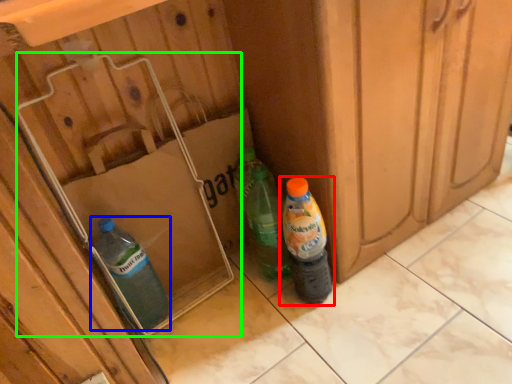
Question: Which object is the closest to the bottle (highlighted by a red box)? Choose among these: bottle (highlighted by a blue box) or cardboard box (highlighted by a green box).

Choices:
 (A) bottle
 (B) cardboard box

Answer: (B)